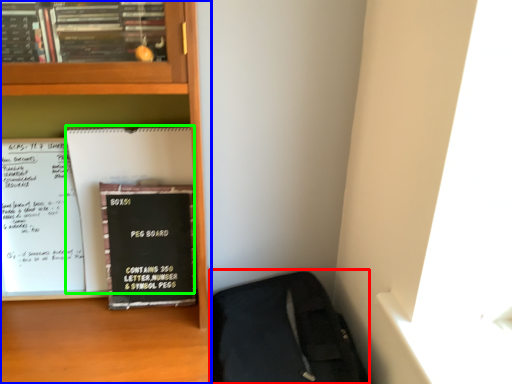
Question: Estimate the real-world distances between objects in this image. Which object is closer to sleeping bag (highlighted by a red box), bookcase (highlighted by a blue box) or paperback book (highlighted by a green box)?

Choices:
 (A) bookcase
 (B) paperback book

Answer: (A)